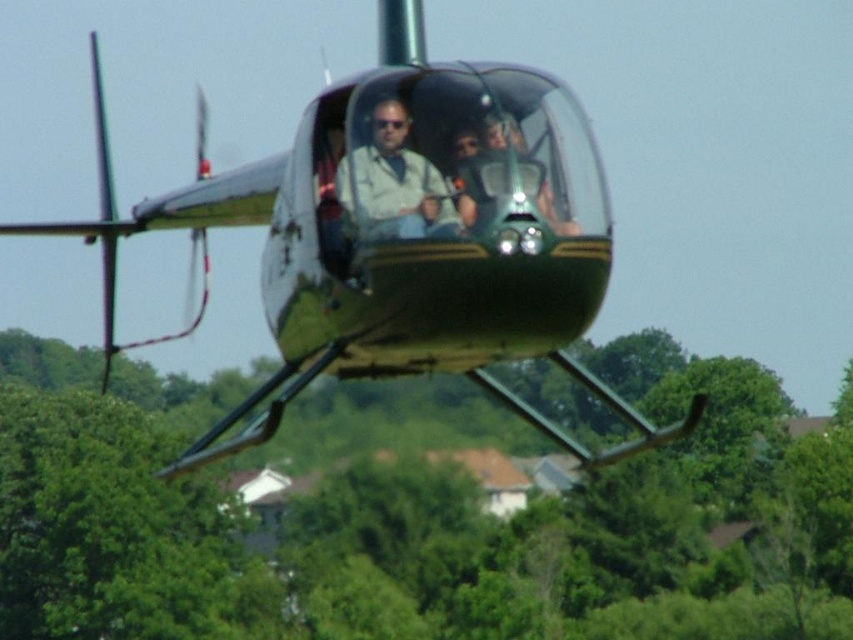
What is the spatial relationship between the metallic green helicopter at center and the matte beige shirt at center in the image?

The metallic green helicopter at center is located to the left of the matte beige shirt at center.

You are a photographer trying to capture a clear photo of the metallic green helicopter at center and the matte beige shirt at center. Which object should you zoom in on to ensure both are in focus without changing the camera position?

The metallic green helicopter at center is bigger than the matte beige shirt at center, so you should zoom in on the metallic green helicopter at center to ensure both are in focus.